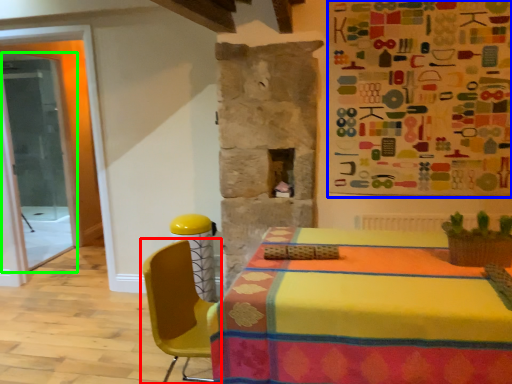
Question: Considering the real-world distances, which object is farthest from chair (highlighted by a red box)? bulletin board (highlighted by a blue box) or glass door (highlighted by a green box)?

Choices:
 (A) bulletin board
 (B) glass door

Answer: (B)